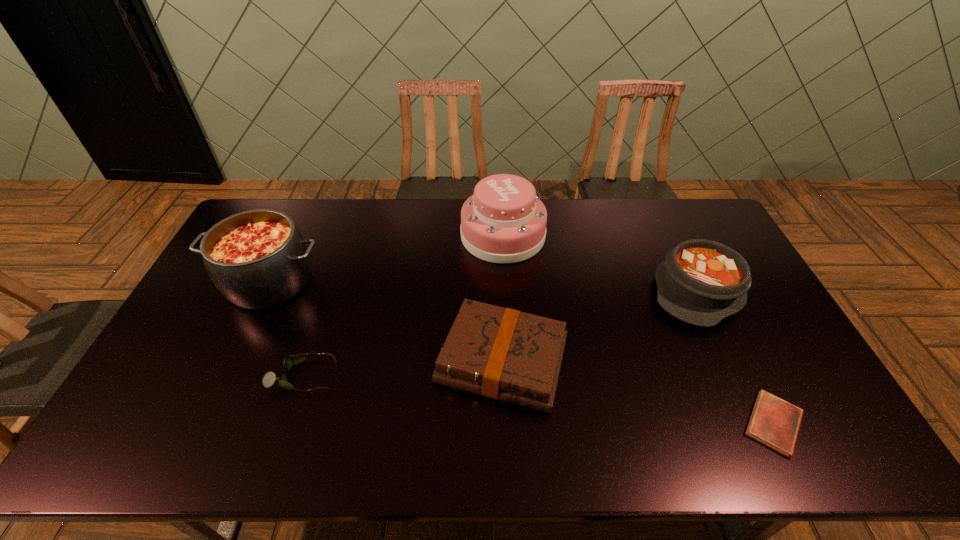
This screenshot has width=960, height=540. Find the location of `vacant space at the near edge of the desktop`. vacant space at the near edge of the desktop is located at coordinates (723, 431).

You are a GUI agent. You are given a task and a screenshot of the screen. Output one action in this format:
    pyautogui.click(x=<x>, y=<y>)
    Task: Click on the vacant space at the left edge of the desktop
    This screenshot has height=540, width=960.
    Given the screenshot: What is the action you would take?
    pyautogui.click(x=211, y=375)

Identify the location of free spot between the third tallest object and the cake. (600, 263).

At what (x,y) coordinates should I click in order to perform the action: click on free space that is in between the spectacles and the cake. Please return your answer as a coordinate pair (x, y). Looking at the image, I should click on (402, 306).

Identify the location of vacant space that is in between the left casserole and the right casserole. Image resolution: width=960 pixels, height=540 pixels. click(x=484, y=286).

The width and height of the screenshot is (960, 540). I want to click on vacant area between the shortest object and the cake, so [x=638, y=329].

Locate an element on the screen. Image resolution: width=960 pixels, height=540 pixels. vacant area that lies between the cake and the third tallest object is located at coordinates point(600,263).

The image size is (960, 540). In order to click on free space between the cake and the hardback book in this screenshot , I will do `click(502, 298)`.

In order to click on free space between the shorter casserole and the cake in this screenshot , I will do `click(600, 263)`.

Find the location of `free space between the fourth tallest object and the diary`. free space between the fourth tallest object and the diary is located at coordinates (638, 392).